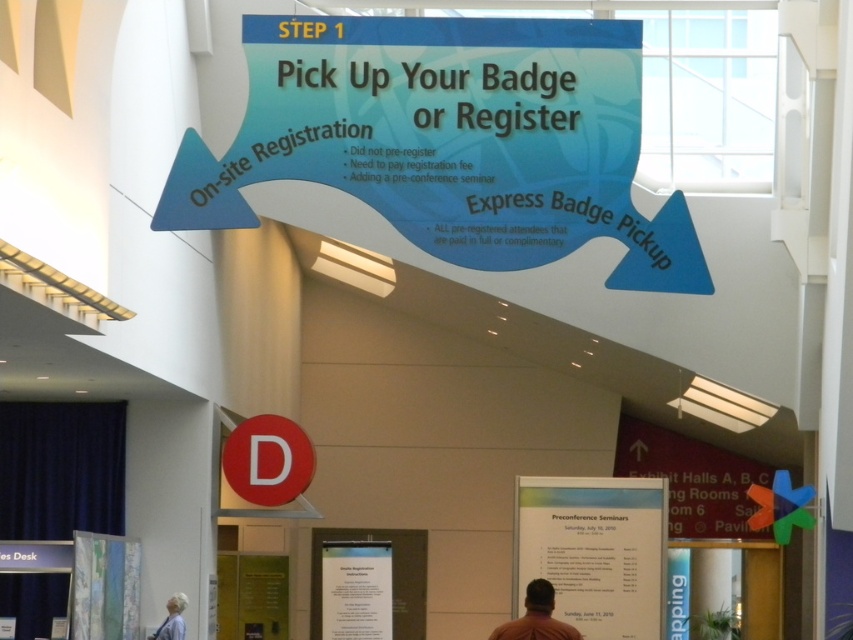
Who is more distant from viewer, (541, 586) or (184, 598)?

The point (184, 598) is more distant.

Does brown shirt at center have a lesser width compared to white fabric at lower left?

Incorrect, brown shirt at center's width is not less than white fabric at lower left's.

Is point (537, 611) closer to viewer compared to point (167, 628)?

Yes, it is in front of point (167, 628).

Locate an element on the screen. This screenshot has width=853, height=640. brown shirt at center is located at coordinates (537, 618).